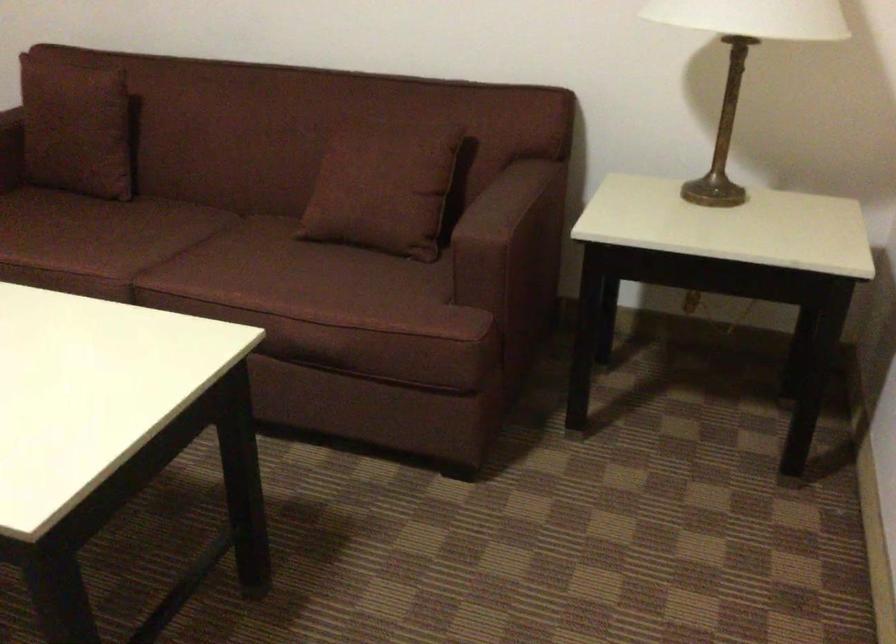
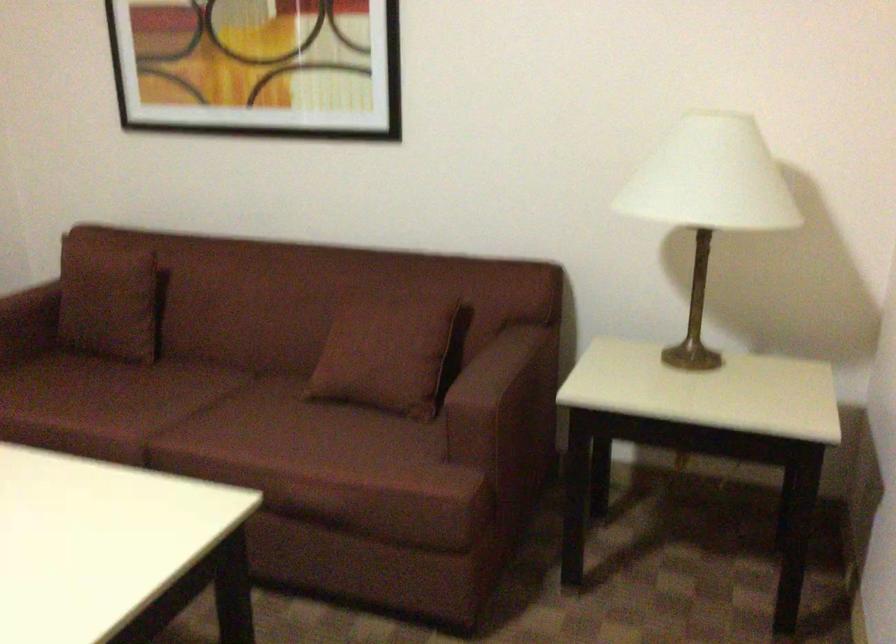
Question: The first image is from the beginning of the video and the second image is from the end. How did the camera likely rotate when shooting the video?

Choices:
 (A) Left
 (B) Right
 (C) Up
 (D) Down

Answer: (C)